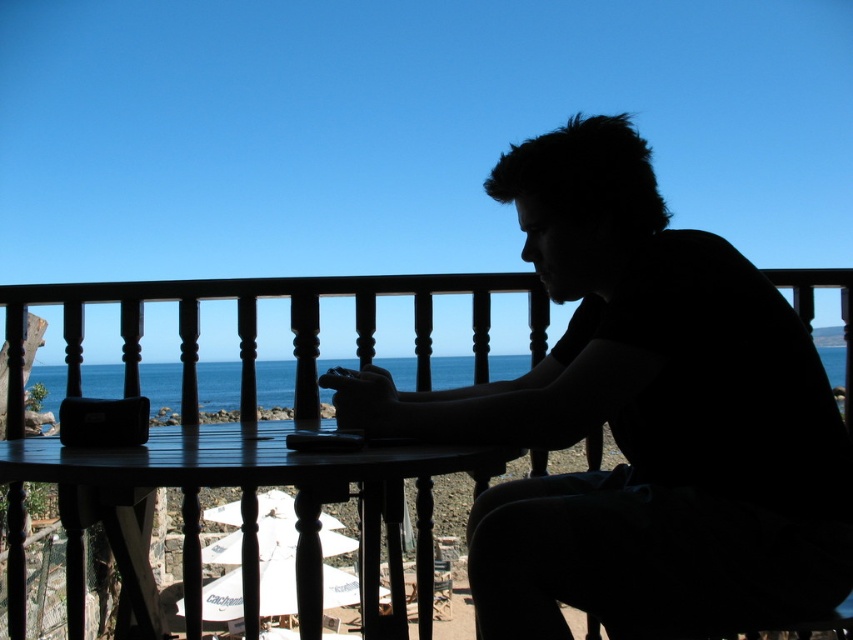
Does wooden at center have a greater width compared to blue water at center?

No.

What do you see at coordinates (254, 380) in the screenshot? I see `wooden at center` at bounding box center [254, 380].

The width and height of the screenshot is (853, 640). Find the location of `wooden at center`. wooden at center is located at coordinates (254, 380).

Can you confirm if silhouette at center is positioned to the left of wooden at center?

Incorrect, silhouette at center is not on the left side of wooden at center.

Is point (699, 618) in front of point (373, 636)?

That is True.

Where is `silhouette at center`? silhouette at center is located at coordinates (640, 419).

I want to click on silhouette at center, so click(640, 419).

Is point (679, 598) less distant than point (131, 460)?

No, (679, 598) is further to viewer.

Can you confirm if silhouette at center is thinner than dark wood table at center?

Indeed, silhouette at center has a lesser width compared to dark wood table at center.

At what (x,y) coordinates should I click in order to perform the action: click on silhouette at center. Please return your answer as a coordinate pair (x, y). Image resolution: width=853 pixels, height=640 pixels. Looking at the image, I should click on tap(640, 419).